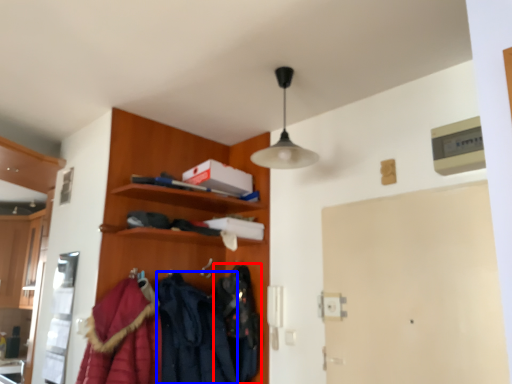
Question: Among these objects, which one is farthest to the camera, clothing (highlighted by a red box) or clothing (highlighted by a blue box)?

Choices:
 (A) clothing
 (B) clothing

Answer: (A)